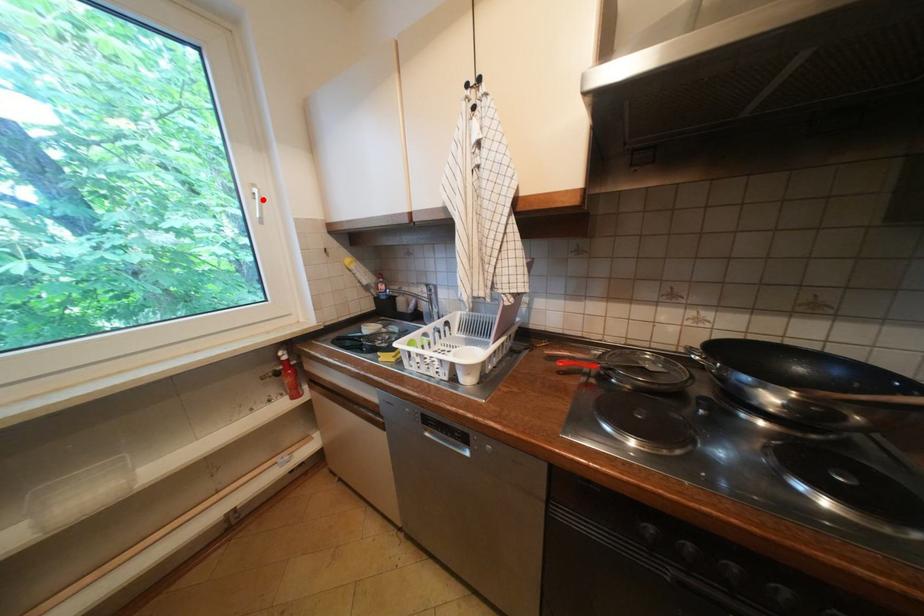
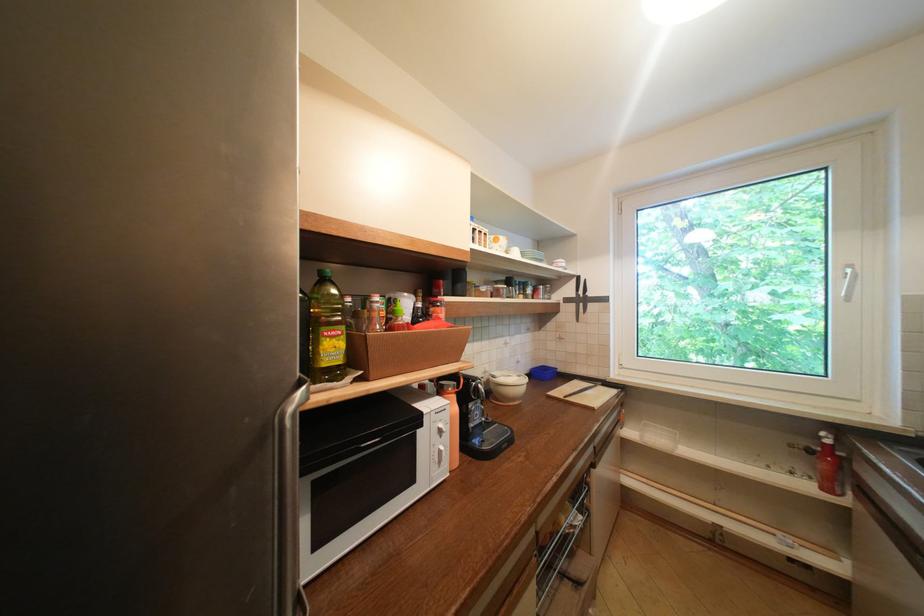
Question: I am providing you with two images of the same scene from different viewpoints. A red point is marked on the first image. At the location where the point appears in image 1, is it still visible in image 2?

Choices:
 (A) Yes
 (B) No

Answer: (A)